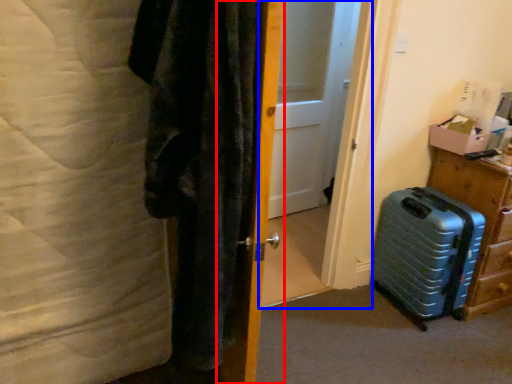
Question: Which object is closer to the camera taking this photo, door (highlighted by a red box) or screen door (highlighted by a blue box)?

Choices:
 (A) door
 (B) screen door

Answer: (A)